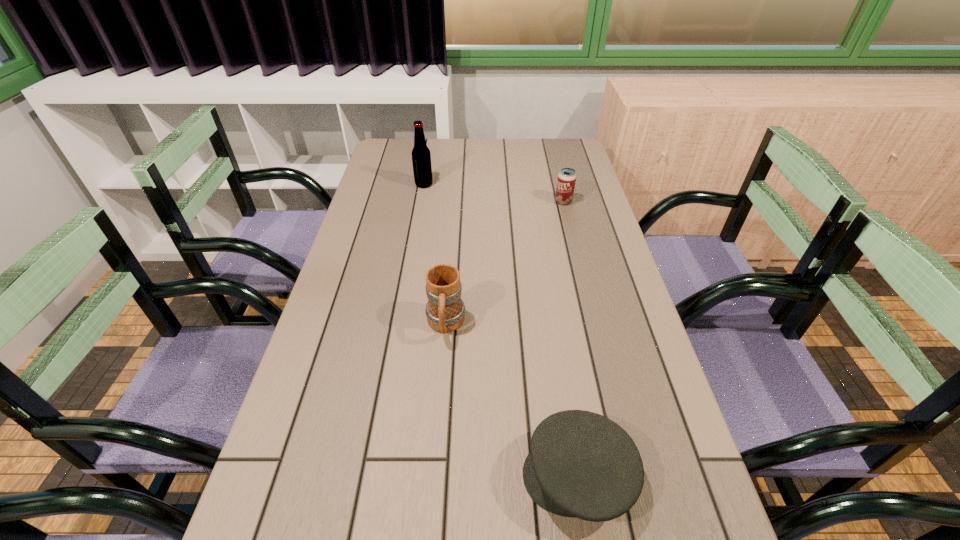
The width and height of the screenshot is (960, 540). In order to click on unoccupied position between the mug and the nearest object in this screenshot , I will do `click(512, 400)`.

In order to click on vacant point located between the second shortest object and the second tallest object in this screenshot , I will do `click(505, 263)`.

The image size is (960, 540). I want to click on free space between the third object from right to left and the tallest object, so click(x=435, y=254).

Find the location of a particular element. unoccupied area between the beer can and the third object from right to left is located at coordinates (505, 263).

The image size is (960, 540). I want to click on free space between the beer bottle and the third object from right to left, so click(435, 254).

You are a GUI agent. You are given a task and a screenshot of the screen. Output one action in this format:
    pyautogui.click(x=<x>, y=<y>)
    Task: Click on the free space that is in between the mug and the beer can
    The image size is (960, 540).
    Given the screenshot: What is the action you would take?
    pyautogui.click(x=505, y=263)

Identify which object is located as the nearest to the nearest object. Please provide its 2D coordinates. Your answer should be formatted as a tuple, i.e. [(x, y)], where the tuple contains the x and y coordinates of a point satisfying the conditions above.

[(445, 310)]

Select which object is the closest to the second object from left to right. Please provide its 2D coordinates. Your answer should be formatted as a tuple, i.e. [(x, y)], where the tuple contains the x and y coordinates of a point satisfying the conditions above.

[(581, 464)]